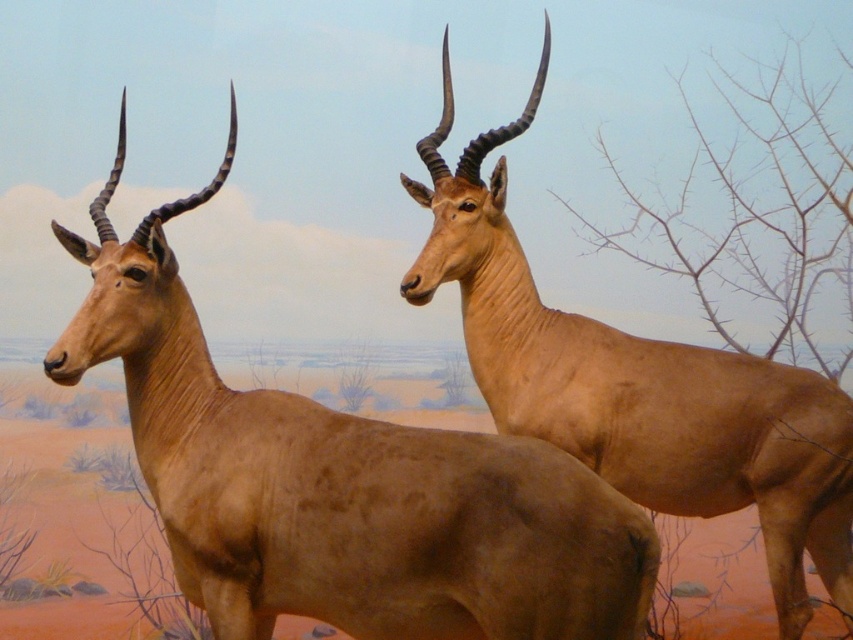
Question: Can you confirm if brown matte/deer at left is positioned below smooth tan antelope at upper right?

Choices:
 (A) yes
 (B) no

Answer: (A)

Question: Is brown matte/deer at left closer to camera compared to smooth tan antelope at upper right?

Choices:
 (A) no
 (B) yes

Answer: (B)

Question: Can you confirm if brown matte/deer at left is smaller than smooth tan antelope at upper right?

Choices:
 (A) yes
 (B) no

Answer: (A)

Question: Which point is farther from the camera taking this photo?

Choices:
 (A) (845, 545)
 (B) (439, 500)

Answer: (A)